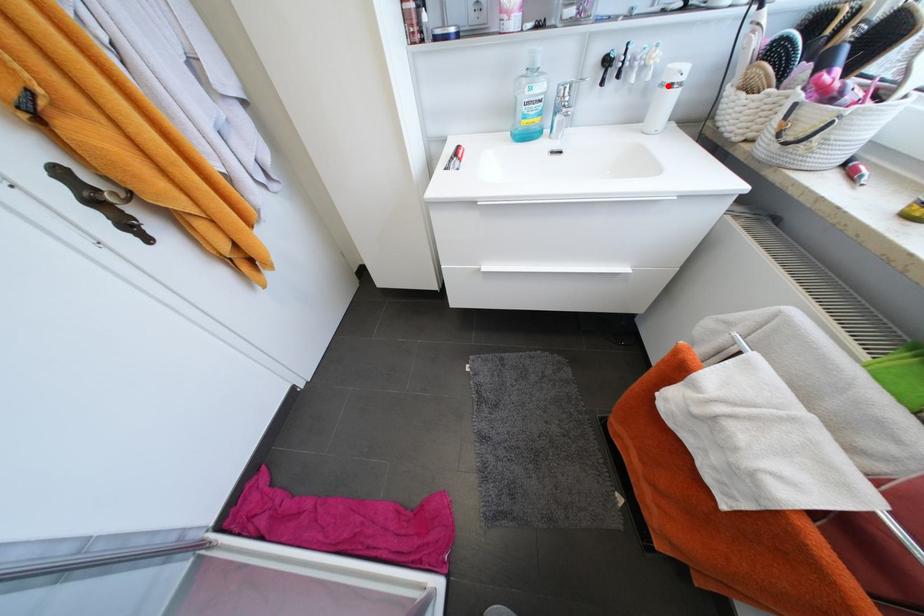
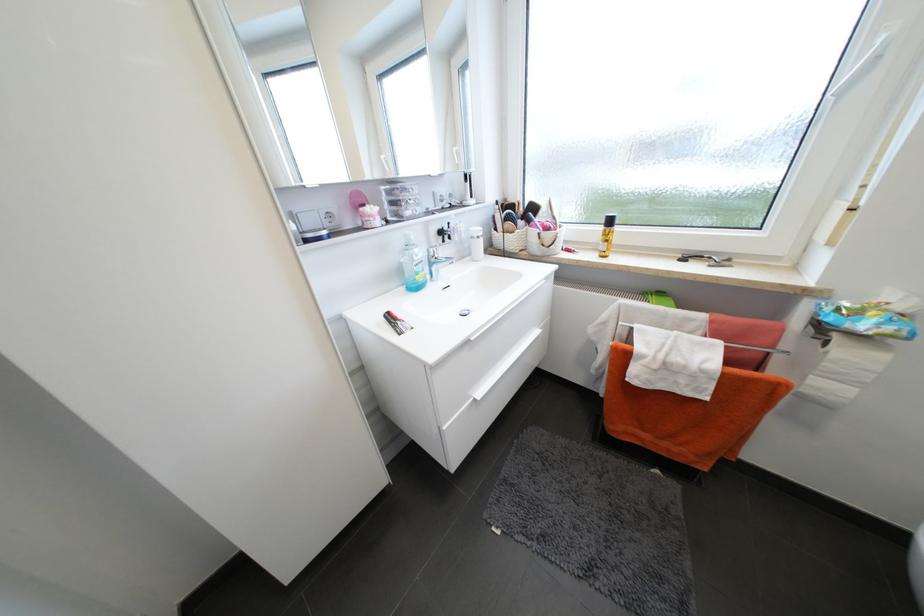
Question: I am providing you with two images of the same scene from different viewpoints. A red point is shown in image1. For the corresponding object point in image2, is it positioned nearer or farther from the camera?

Choices:
 (A) Nearer
 (B) Farther

Answer: (A)